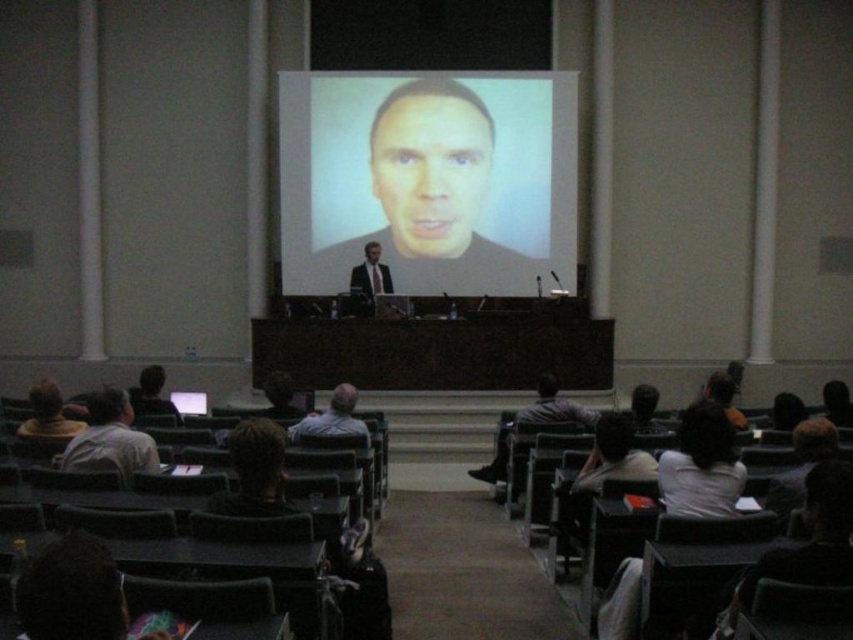
You are an attendee sitting in the front row of the lecture hall. You need to reach the podium to ask a question but want to ensure you can walk straight from your seat to the podium without needing to detour. The podium is located where the light gray shirt at lower left is. Can you walk straight to the podium from your current position at the matte screen at center?

The distance between the matte screen at center and the light gray shirt at lower left is 5.78 meters. Since you are at the matte screen at center and the podium is at the light gray shirt at lower left, you can walk straight to the podium as there is a clear path between them.

You are an attendee in the lecture hall and want to take a photo of both the matte screen at center and the matte black face at center. Which one should you focus on first to ensure both are in frame?

The matte black face at center is located below the matte screen at center, so focusing on the screen first and adjusting the camera angle downward will ensure both are captured in the photo.

You are attending a lecture in the lecture hall and need to move from your current position to the front row. The front row is located at point [102,406]. However, there is an obstacle at point [380,211]. Can you safely navigate around the obstacle to reach the front row?

Point [380,211] is behind point [102,406], so the obstacle is not in your path to the front row. You can safely navigate to the front row without encountering the obstacle.